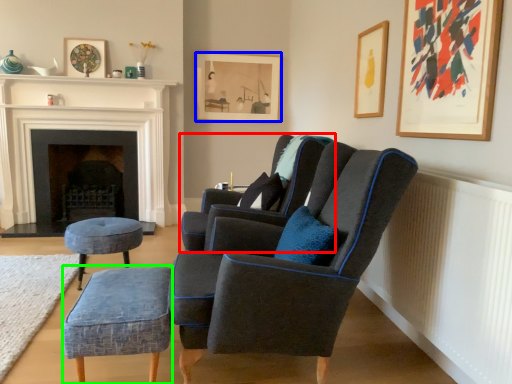
Question: Which object is the farthest from chair (highlighted by a red box)? Choose among these: picture frame (highlighted by a blue box) or stool (highlighted by a green box).

Choices:
 (A) picture frame
 (B) stool

Answer: (A)